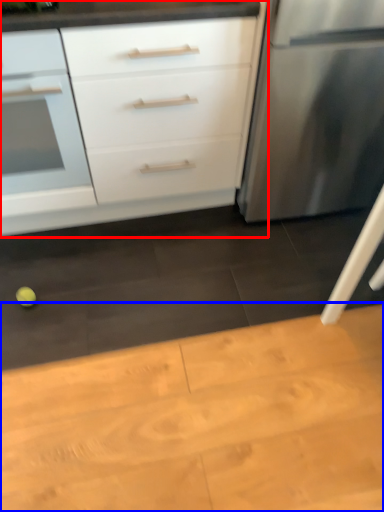
Question: Which object is closer to the camera taking this photo, chest of drawers (highlighted by a red box) or table (highlighted by a blue box)?

Choices:
 (A) chest of drawers
 (B) table

Answer: (B)